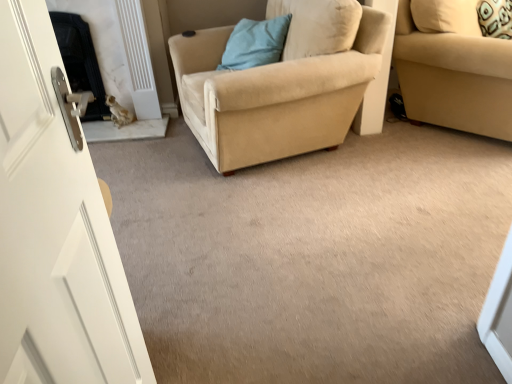
Question: Does beige suede armchair at center touch beige fabric studio couch at right?

Choices:
 (A) no
 (B) yes

Answer: (A)

Question: Is beige suede armchair at center outside beige fabric studio couch at right?

Choices:
 (A) yes
 (B) no

Answer: (A)

Question: Is beige fabric studio couch at right at the back of beige suede armchair at center?

Choices:
 (A) yes
 (B) no

Answer: (A)

Question: Can you confirm if beige suede armchair at center is wider than beige fabric studio couch at right?

Choices:
 (A) yes
 (B) no

Answer: (A)

Question: From the image's perspective, is beige suede armchair at center on beige fabric studio couch at right?

Choices:
 (A) no
 (B) yes

Answer: (A)

Question: From a real-world perspective, relative to beige suede armchair at center, is blue fabric pillow at upper center vertically above or below?

Choices:
 (A) below
 (B) above

Answer: (B)

Question: Would you say blue fabric pillow at upper center is inside or outside beige suede armchair at center?

Choices:
 (A) inside
 (B) outside

Answer: (A)

Question: In terms of width, does blue fabric pillow at upper center look wider or thinner when compared to beige suede armchair at center?

Choices:
 (A) thin
 (B) wide

Answer: (A)

Question: Looking at the image, does blue fabric pillow at upper center seem bigger or smaller compared to beige suede armchair at center?

Choices:
 (A) big
 (B) small

Answer: (B)

Question: Is point (272, 87) positioned closer to the camera than point (285, 34)?

Choices:
 (A) farther
 (B) closer

Answer: (B)

Question: Considering the relative positions of beige suede armchair at center and blue fabric pillow at upper center in the image provided, is beige suede armchair at center to the left or to the right of blue fabric pillow at upper center?

Choices:
 (A) right
 (B) left

Answer: (A)

Question: In terms of width, does beige suede armchair at center look wider or thinner when compared to blue fabric pillow at upper center?

Choices:
 (A) wide
 (B) thin

Answer: (A)

Question: From a real-world perspective, is beige suede armchair at center above or below blue fabric pillow at upper center?

Choices:
 (A) below
 (B) above

Answer: (A)

Question: Relative to beige suede armchair at center, is black marble fireplace at left in front or behind?

Choices:
 (A) front
 (B) behind

Answer: (B)

Question: Considering the positions of black marble fireplace at left and beige suede armchair at center in the image, is black marble fireplace at left wider or thinner than beige suede armchair at center?

Choices:
 (A) wide
 (B) thin

Answer: (B)